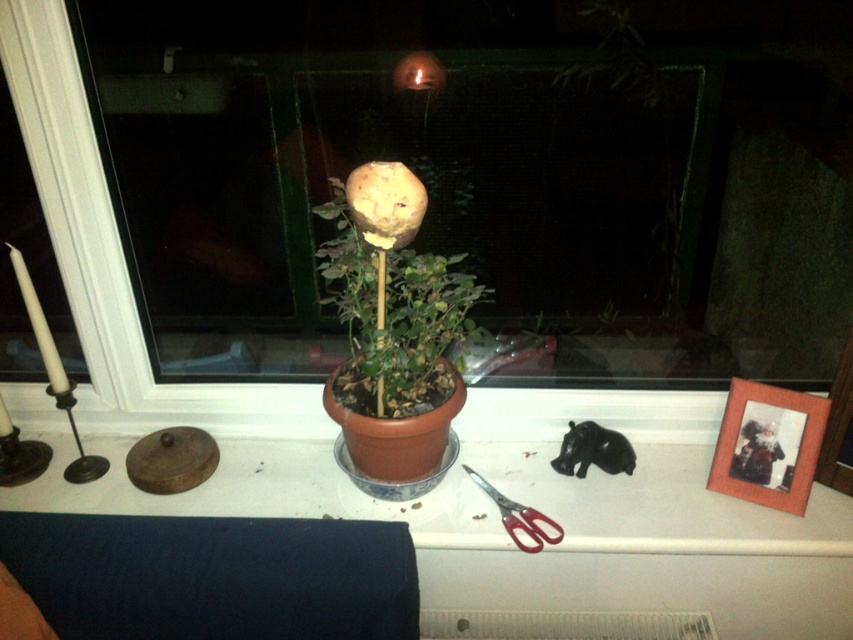
You are standing in front of the windowsill scene described. You notice a point marked at coordinates (392, 291). What object is located at that point?

The point at coordinates (392, 291) corresponds to the matte brown pot at center.

You are organizing items on a windowsill and notice the matte brown pot at center and the red plastic scissors at lower right. Which item is placed above the other?

The matte brown pot at center is positioned over the red plastic scissors at lower right, so the pot is above the scissors.

You are organizing a craft project and need to store the red plastic scissors at lower right and the transparent glass window at center. Which object requires a larger storage space?

The transparent glass window at center requires a larger storage space because it has a larger size compared to the red plastic scissors at lower right.